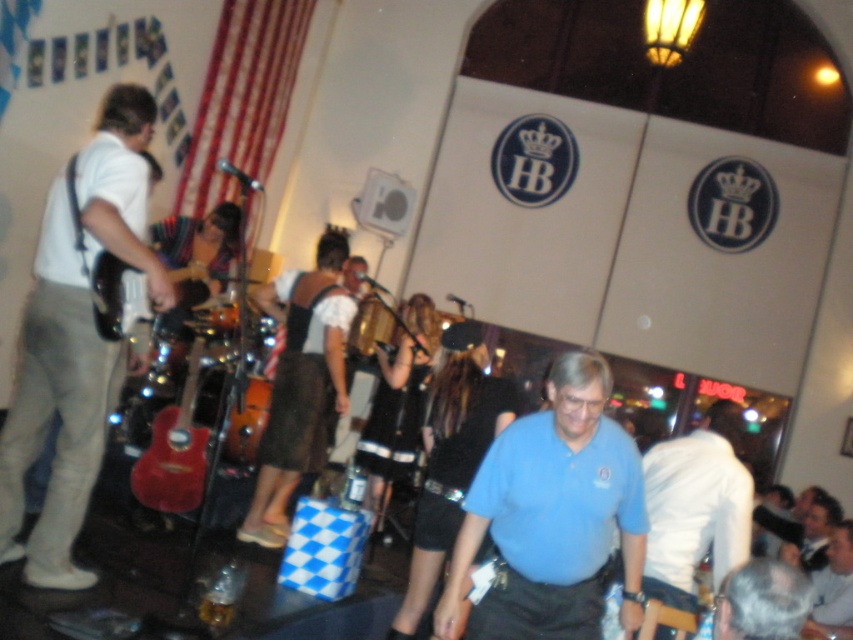
You are a photographer standing at the back of the bar. You want to take a photo of both the blue cotton shirt at center and the white cotton shirt at center. Since you want them both in focus, you need to know which shirt is wider. Which shirt has a greater width?

The blue cotton shirt at center has a greater width than the white cotton shirt at center.

You are a photographer at the bar and want to capture both the white matte guitar at left and the white cotton shirt at center in a single photo. Since both are white, you need to adjust the camera focus to ensure one isn not blurred. Based on their positions, which object should you focus on to keep it sharp while the other becomes slightly blurred?

You should focus on the white matte guitar at left because it is in front of the white cotton shirt at center. By focusing on the closer object, the background object will naturally become blurred.